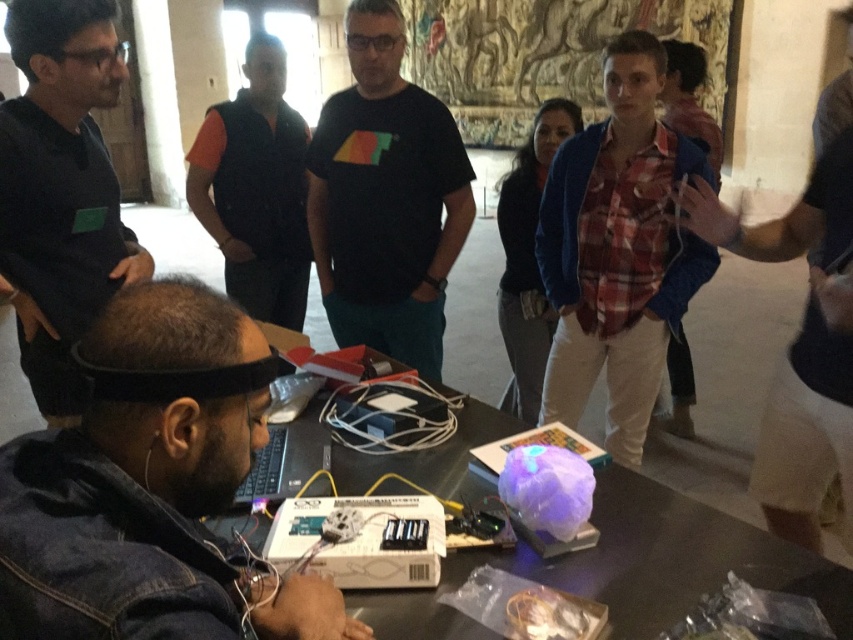
You are a photographer standing at the entrance of the room. You want to take a photo of the metallic table at center without the denim jacket at lower left appearing in the frame. Is it possible to adjust your position to achieve this?

The denim jacket at lower left is in front of the metallic table at center, so by moving to a position where the denim jacket is no longer blocking the view, you can capture the metallic table at center without it.

You are standing in the room and want to reach both the point at coordinates (421, 90) and the point at coordinates (103, 214). Which point is closer to you?

Point (103, 214) is closer to you because it is nearer to the camera than point (421, 90).

You are standing in the room and want to hand a tool to both the person wearing the denim jacket at lower left and the person wearing the black matte shirt at upper left. Which person should you approach first to ensure you can reach them without moving further away from your current position?

You should approach the denim jacket at lower left first because it is closer to you than the black matte shirt at upper left, so you can reach them without needing to move further away.